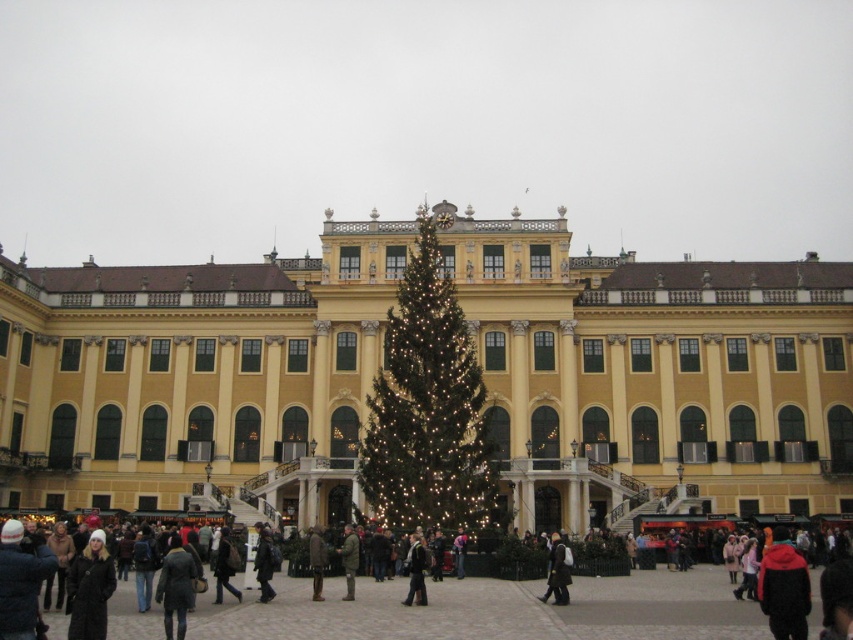
You are standing in front of the grand ornate building with pale yellow walls and dark green shutters. There is a large illuminated Christmas tree in front of the building. You see a point at coordinate [653,376]. Based on the scene description, where is this point located?

The point at coordinate [653,376] is on the yellow matte building at center.

You are organizing a photo shoot and need to place a tripod between the green textured christmas tree at center and the red fleece jacket at lower right. Based on their sizes, will the tripod fit comfortably between them?

The green textured christmas tree at center might be wider than the red fleece jacket at lower right, so there may not be enough space for the tripod to fit comfortably between them.

You are a photographer trying to capture the yellow matte building at center and the camouflage jacket at center in a single photo. Based on their positions, can you determine which object will appear larger in the photo?

The yellow matte building at center is positioned over the camouflage jacket at center, so it will appear larger in the photo because objects closer to the camera appear larger.